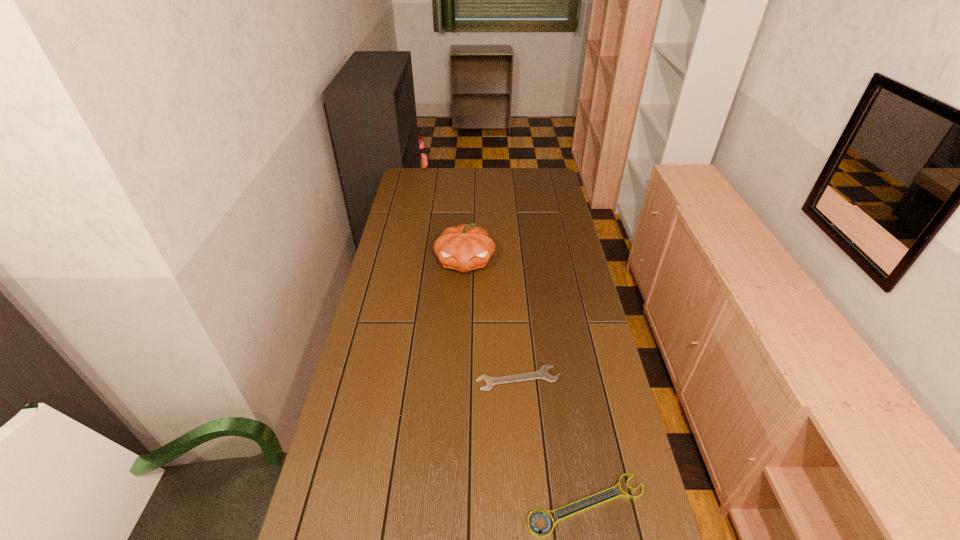
Locate an element on the screen. The image size is (960, 540). the leftmost object is located at coordinates (422, 161).

Locate an element on the screen. the farthest object is located at coordinates (422, 161).

Where is `the second farthest object`? This screenshot has width=960, height=540. the second farthest object is located at coordinates [x=465, y=247].

At what (x,y) coordinates should I click in order to perform the action: click on the second nearest object. Please return your answer as a coordinate pair (x, y). Looking at the image, I should click on (543, 373).

This screenshot has height=540, width=960. Find the location of `the nearer wrench`. the nearer wrench is located at coordinates (613, 497).

Identify the location of vacant space situated 0.270m on the right of the farthest object. The height and width of the screenshot is (540, 960). (481, 172).

This screenshot has height=540, width=960. I want to click on blank space located 0.330m on the front face of the third nearest object, so click(x=461, y=351).

Identify the location of vacant point located on the back of the third farthest object. The height and width of the screenshot is (540, 960). (516, 351).

This screenshot has height=540, width=960. Identify the location of free space located 0.220m on the left of the nearer wrench. (432, 505).

At what (x,y) coordinates should I click in order to perform the action: click on object located in the far edge section of the desktop. Please return your answer as a coordinate pair (x, y). This screenshot has height=540, width=960. Looking at the image, I should click on (422, 161).